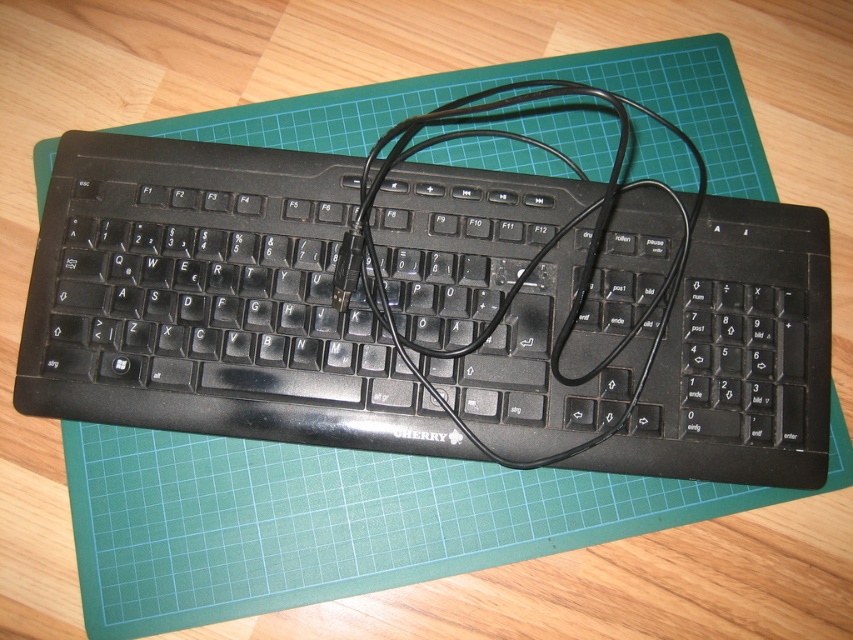
Does black plastic keyboard at center lie behind black cable at center?

Yes, black plastic keyboard at center is behind black cable at center.

Between point (482, 358) and point (430, 141), which one is positioned in front?

Point (482, 358)

Identify the location of black plastic keyboard at center. (212, 300).